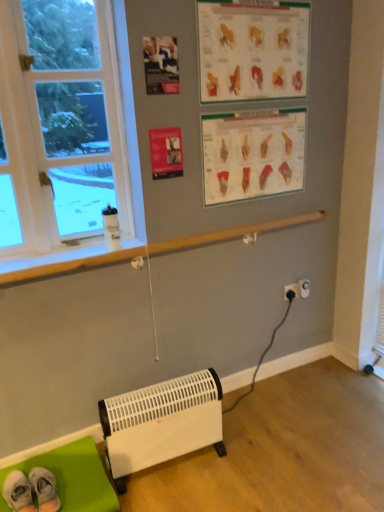
I want to click on free space to the right of white plastic heater at lower center, so click(254, 458).